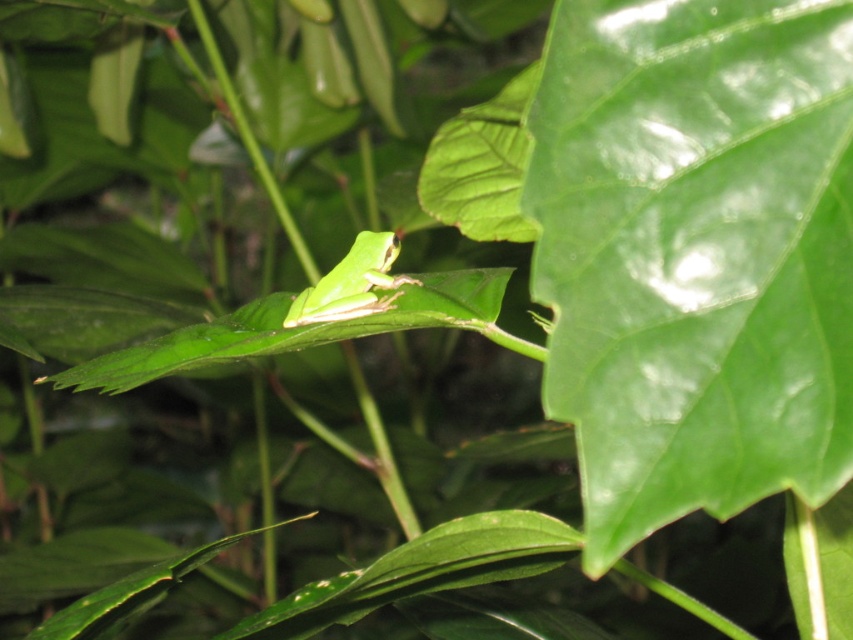
Question: Which point is closer to the camera?

Choices:
 (A) green matte frog at center
 (B) green matte leaf at center

Answer: (B)

Question: Does green matte leaf at center have a lesser width compared to green matte frog at center?

Choices:
 (A) yes
 (B) no

Answer: (A)

Question: Which point appears farthest from the camera in this image?

Choices:
 (A) tap(346, 305)
 (B) tap(705, 422)

Answer: (A)

Question: Can you confirm if green matte leaf at center is thinner than green matte frog at center?

Choices:
 (A) yes
 (B) no

Answer: (A)

Question: Is green matte leaf at center above green matte frog at center?

Choices:
 (A) no
 (B) yes

Answer: (A)